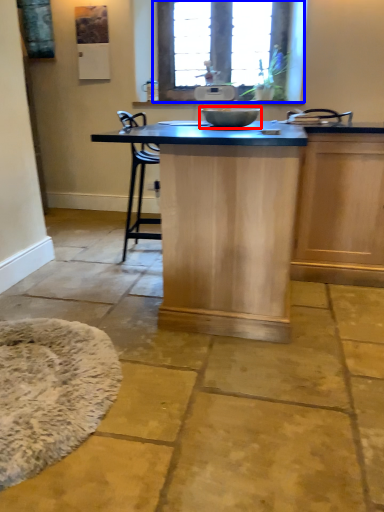
Question: Which point is further to the camera, mixing bowl (highlighted by a red box) or window (highlighted by a blue box)?

Choices:
 (A) mixing bowl
 (B) window

Answer: (B)